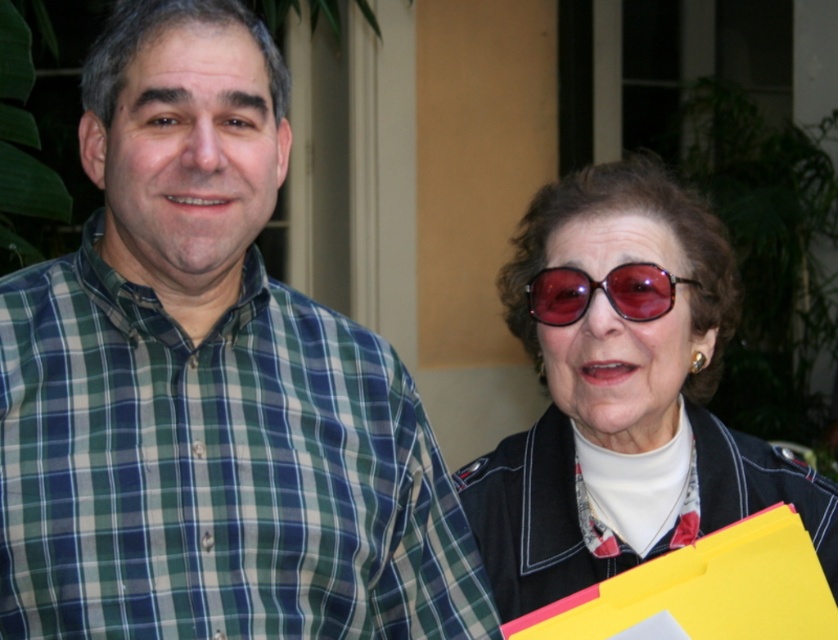
Question: Can you confirm if matte black sunglasses at upper right is positioned above red tortoiseshell sunglasses at upper center?

Choices:
 (A) no
 (B) yes

Answer: (A)

Question: Which object appears farthest from the camera in this image?

Choices:
 (A) red tortoiseshell sunglasses at upper center
 (B) green plaid shirt at center

Answer: (A)

Question: Which of the following is the closest to the observer?

Choices:
 (A) (582, 308)
 (B) (639, 317)
 (C) (235, 344)

Answer: (C)

Question: Is matte black sunglasses at upper right to the left of red tortoiseshell sunglasses at upper center from the viewer's perspective?

Choices:
 (A) no
 (B) yes

Answer: (A)

Question: Which object is closer to the camera taking this photo?

Choices:
 (A) red tortoiseshell sunglasses at upper center
 (B) matte black sunglasses at upper right

Answer: (B)

Question: Is green plaid shirt at center behind red tortoiseshell sunglasses at upper center?

Choices:
 (A) yes
 (B) no

Answer: (B)